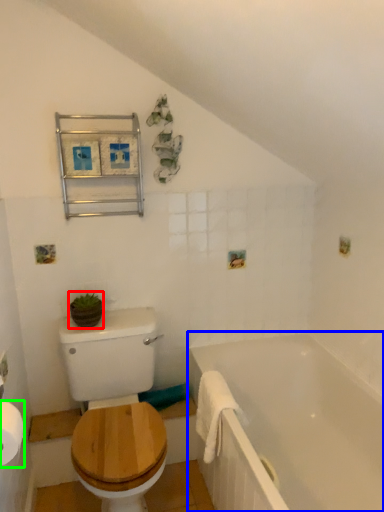
Question: Considering the real-world distances, which object is closest to plant (highlighted by a red box)? bathtub (highlighted by a blue box) or toilet paper (highlighted by a green box).

Choices:
 (A) bathtub
 (B) toilet paper

Answer: (B)